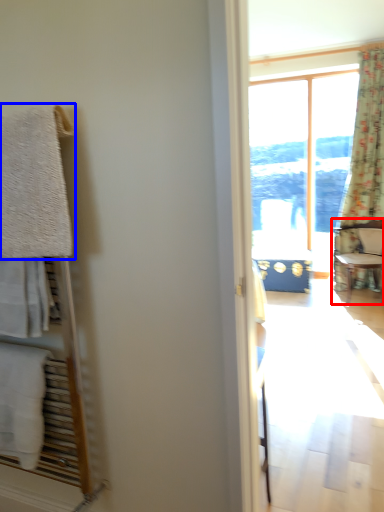
Question: Which object appears farthest to the camera in this image, chair (highlighted by a red box) or towel/napkin (highlighted by a blue box)?

Choices:
 (A) chair
 (B) towel/napkin

Answer: (A)